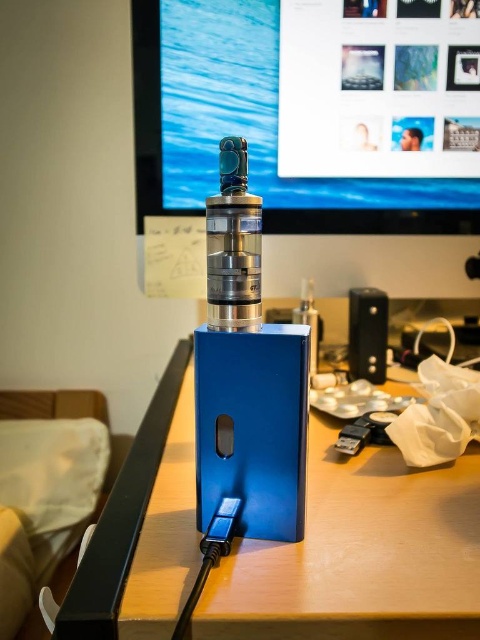
Is blue metallic box at center below black plastic speaker at right?

Yes.

What do you see at coordinates (360, 556) in the screenshot? This screenshot has height=640, width=480. I see `blue metallic box at center` at bounding box center [360, 556].

Is point (450, 636) positioned after point (349, 378)?

No, it is in front of (349, 378).

In order to click on blue metallic box at center in this screenshot , I will do `click(360, 556)`.

Consider the image. Can you confirm if matte black monitor at upper center is positioned below black plastic speaker at right?

Incorrect, matte black monitor at upper center is not positioned below black plastic speaker at right.

Is matte black monitor at upper center positioned in front of black plastic speaker at right?

Yes, it is in front of black plastic speaker at right.

Which is behind, point (240, 61) or point (360, 307)?

Point (360, 307)

What are the coordinates of `matte black monitor at upper center` in the screenshot? It's located at (312, 109).

Can you confirm if matte black monitor at upper center is positioned below blue metallic box at center?

Incorrect, matte black monitor at upper center is not positioned below blue metallic box at center.

What do you see at coordinates (312, 109) in the screenshot?
I see `matte black monitor at upper center` at bounding box center [312, 109].

Is point (350, 150) positioned before point (175, 595)?

No, it is behind (175, 595).

Find the location of a particular element. The image size is (480, 640). matte black monitor at upper center is located at coordinates coord(312,109).